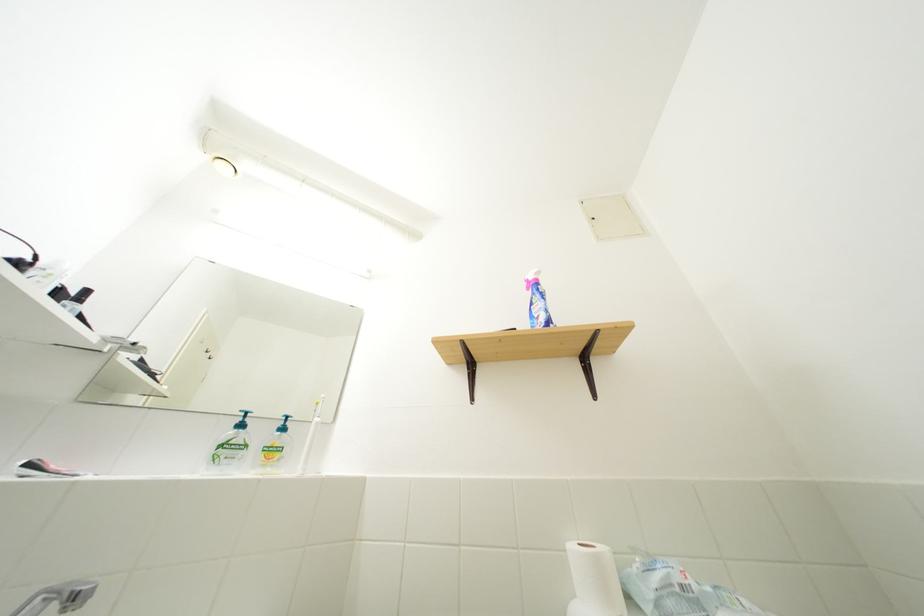
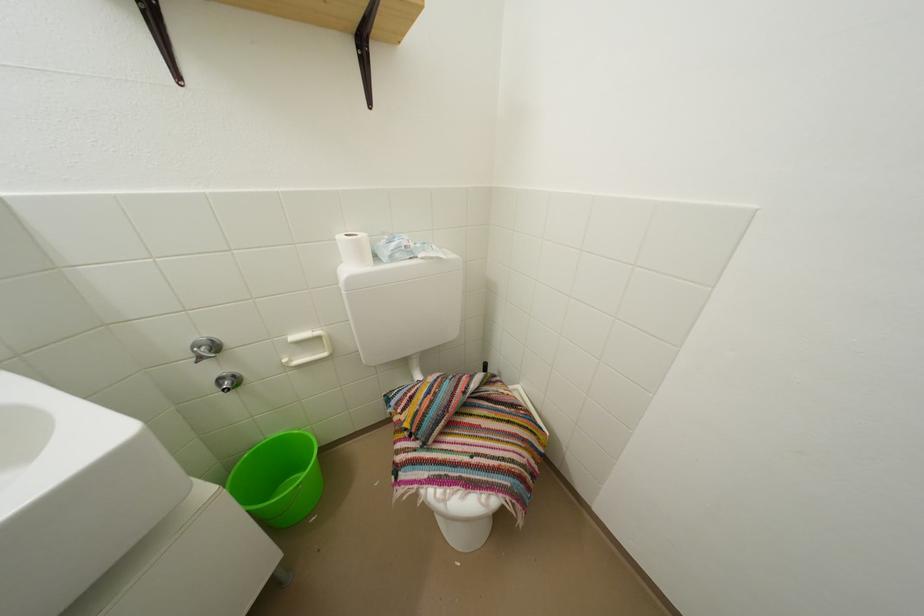
The point at (665, 585) is marked in the first image. Where is the corresponding point in the second image?

(402, 251)